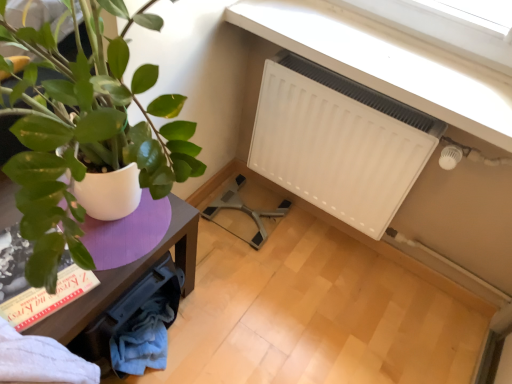
What do you see at coordinates (387, 62) in the screenshot? This screenshot has width=512, height=384. I see `white plastic radiator at upper right` at bounding box center [387, 62].

What do you see at coordinates (338, 142) in the screenshot? I see `white matte radiator at upper right` at bounding box center [338, 142].

Describe the element at coordinates (128, 277) in the screenshot. This screenshot has width=512, height=384. I see `purple wood table at left` at that location.

In order to face hardcover book at lower left, should I rotate leftwards or rightwards?

Rotate your view left by about 28.196°.

Find the location of a particular element. The image size is (512, 384). white plastic radiator at upper right is located at coordinates (387, 62).

Can you confirm if hardcover book at lower left is thinner than white plastic radiator at upper right?

No.

From a real-world perspective, is hardcover book at lower left below white plastic radiator at upper right?

Indeed, from a real-world perspective, hardcover book at lower left is positioned beneath white plastic radiator at upper right.

Is hardcover book at lower left to the left of white plastic radiator at upper right from the viewer's perspective?

Yes, hardcover book at lower left is to the left of white plastic radiator at upper right.

Is point (36, 310) in front of point (362, 33)?

Yes, it is in front of point (362, 33).

Identify the location of book below the white matte radiator at upper right (from the image's perspective). (33, 287).

Considering the relative sizes of hardcover book at lower left and white matte radiator at upper right in the image provided, is hardcover book at lower left taller than white matte radiator at upper right?

No, hardcover book at lower left is not taller than white matte radiator at upper right.

From a real-world perspective, is hardcover book at lower left physically above white matte radiator at upper right?

Yes, from a real-world perspective, hardcover book at lower left is on top of white matte radiator at upper right.

Is hardcover book at lower left far from white matte radiator at upper right?

Actually, hardcover book at lower left and white matte radiator at upper right are a little close together.

Measure the distance between white matte radiator at upper right and hardcover book at lower left.

They are 35.47 inches apart.

Does point (336, 85) come behind point (97, 279)?

Yes, it is.

Is white matte radiator at upper right oriented towards hardcover book at lower left?

Yes.

Does white matte radiator at upper right have a larger size compared to hardcover book at lower left?

Yes, white matte radiator at upper right is bigger than hardcover book at lower left.

Looking at this image, considering the positions of objects white plastic radiator at upper right and hardcover book at lower left in the image provided, who is more to the left, white plastic radiator at upper right or hardcover book at lower left?

hardcover book at lower left.

From a real-world perspective, is white plastic radiator at upper right physically below hardcover book at lower left?

No, from a real-world perspective, white plastic radiator at upper right is not beneath hardcover book at lower left.

Which object is closer to the camera taking this photo, white plastic radiator at upper right or hardcover book at lower left?

hardcover book at lower left is more forward.

From the image's perspective, is white plastic radiator at upper right positioned above or below hardcover book at lower left?

Based on their image positions, white plastic radiator at upper right is located above hardcover book at lower left.

From a real-world perspective, relative to white matte radiator at upper right, is white plastic radiator at upper right vertically above or below?

From a real-world perspective, white plastic radiator at upper right is physically above white matte radiator at upper right.

Is white plastic radiator at upper right wider or thinner than white matte radiator at upper right?

white plastic radiator at upper right is wider than white matte radiator at upper right.

Which object is further away from the camera taking this photo, white plastic radiator at upper right or white matte radiator at upper right?

white matte radiator at upper right is further away from the camera.

From the image's perspective, which is above, white plastic radiator at upper right or white matte radiator at upper right?

white plastic radiator at upper right.

From the picture: From the image's perspective, does purple wood table at left appear lower than white matte radiator at upper right?

Yes, from the image's perspective, purple wood table at left is below white matte radiator at upper right.

Is white matte radiator at upper right at the back of purple wood table at left?

That's right, purple wood table at left is facing away from white matte radiator at upper right.

Is purple wood table at left next to white matte radiator at upper right?

They are not placed beside each other.

Which object is further away from the camera, purple wood table at left or white matte radiator at upper right?

Positioned behind is white matte radiator at upper right.

Is the surface of purple wood table at left in direct contact with white plastic radiator at upper right?

No.

Considering the sizes of purple wood table at left and white plastic radiator at upper right in the image, is purple wood table at left bigger or smaller than white plastic radiator at upper right?

In the image, purple wood table at left appears to be larger than white plastic radiator at upper right.

Which is more to the right, purple wood table at left or white plastic radiator at upper right?

Positioned to the right is white plastic radiator at upper right.

Image resolution: width=512 pixels, height=384 pixels. Find the location of `book that is on the left side of white plastic radiator at upper right`. book that is on the left side of white plastic radiator at upper right is located at coordinates (33, 287).

Identify the location of book above the white matte radiator at upper right (from a real-world perspective). Image resolution: width=512 pixels, height=384 pixels. (33, 287).

When comparing their distances from hardcover book at lower left, does white plastic radiator at upper right or purple wood table at left seem further?

white plastic radiator at upper right.

Considering their positions, is purple wood table at left positioned closer to white plastic radiator at upper right than hardcover book at lower left?

purple wood table at left is positioned closer to the anchor white plastic radiator at upper right.

Based on the photo, looking at the image, which one is located further to white matte radiator at upper right, hardcover book at lower left or purple wood table at left?

hardcover book at lower left is further to white matte radiator at upper right.

Which object lies nearer to the anchor point white plastic radiator at upper right, hardcover book at lower left or purple wood table at left?

purple wood table at left is positioned closer to the anchor white plastic radiator at upper right.

Estimate the real-world distances between objects in this image. Which object is closer to white matte radiator at upper right, white plastic radiator at upper right or hardcover book at lower left?

white plastic radiator at upper right is positioned closer to the anchor white matte radiator at upper right.

From the image, which object appears to be farther from white plastic radiator at upper right, white matte radiator at upper right or purple wood table at left?

The object further to white plastic radiator at upper right is purple wood table at left.

From the image, which object appears to be farther from hardcover book at lower left, white matte radiator at upper right or purple wood table at left?

Among the two, white matte radiator at upper right is located further to hardcover book at lower left.

From the image, which object appears to be farther from white matte radiator at upper right, purple wood table at left or white plastic radiator at upper right?

purple wood table at left.

Identify the location of table between hardcover book at lower left and white plastic radiator at upper right from left to right. The height and width of the screenshot is (384, 512). (128, 277).

Image resolution: width=512 pixels, height=384 pixels. What are the coordinates of `radiator between purple wood table at left and white plastic radiator at upper right from left to right` in the screenshot? It's located at (338, 142).

This screenshot has height=384, width=512. Find the location of `radiator situated between hardcover book at lower left and white plastic radiator at upper right from left to right`. radiator situated between hardcover book at lower left and white plastic radiator at upper right from left to right is located at coordinates (338, 142).

I want to click on table situated between hardcover book at lower left and white matte radiator at upper right from left to right, so (128, 277).